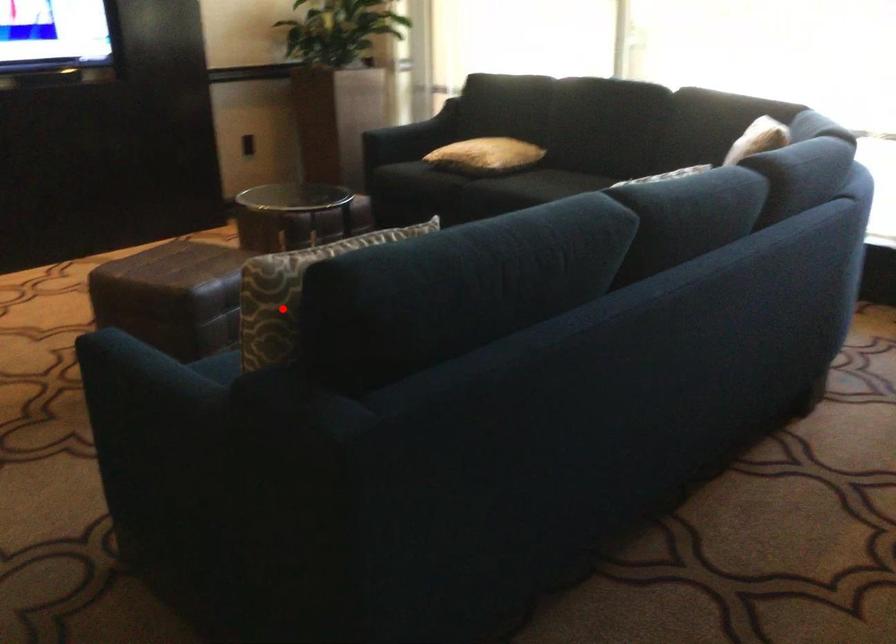
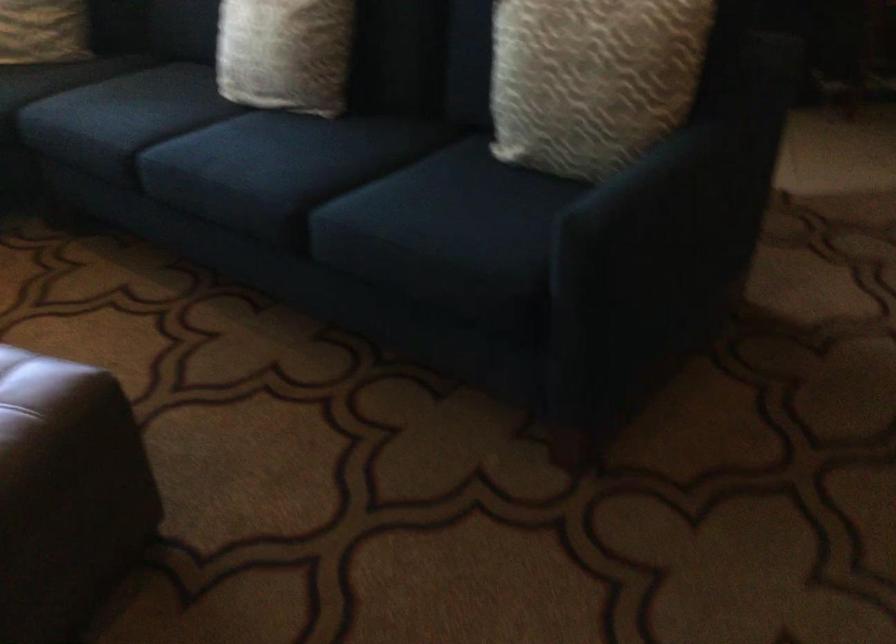
In the second image, find the point that corresponds to the highlighted location in the first image.

(591, 80)